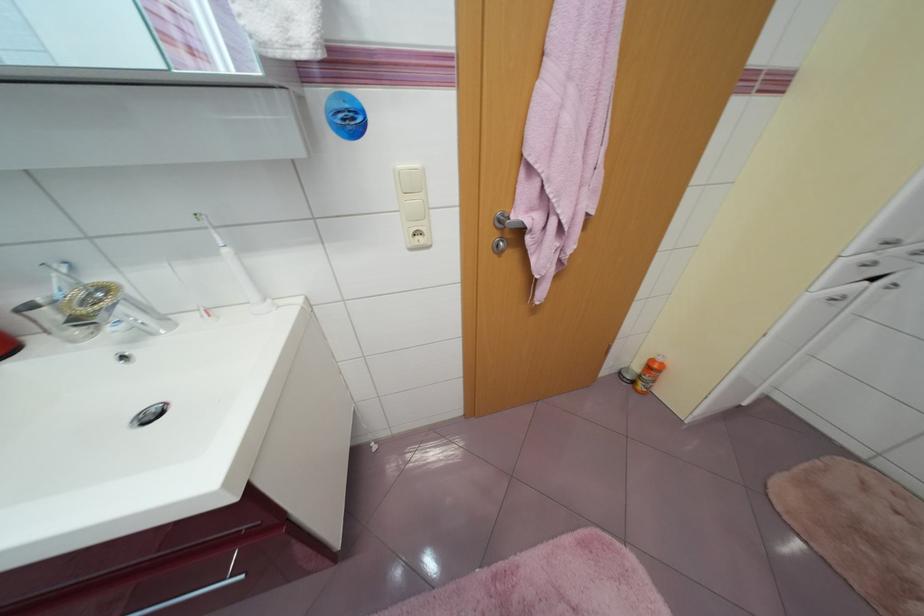
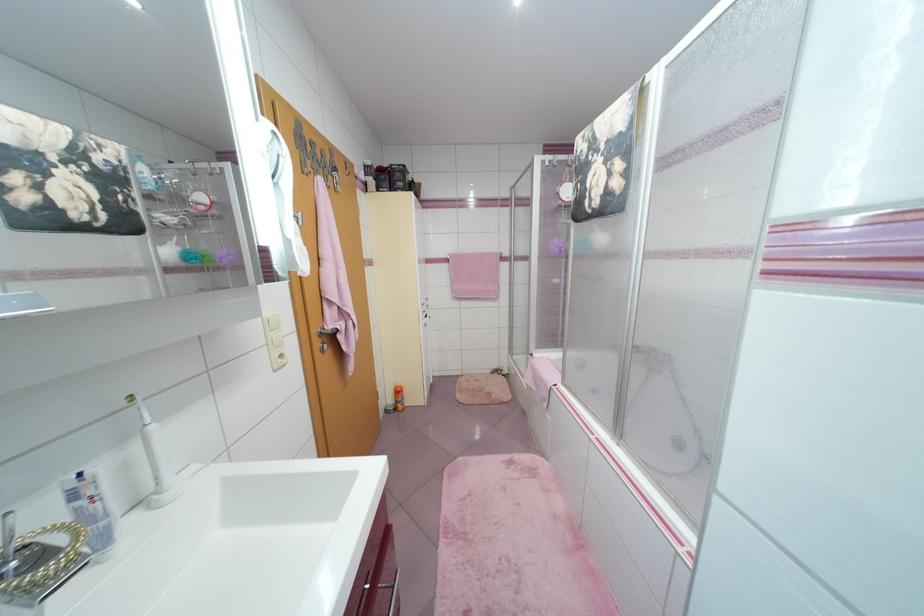
Question: How did the camera likely rotate?

Choices:
 (A) Left
 (B) Right
 (C) Up
 (D) Down

Answer: (B)